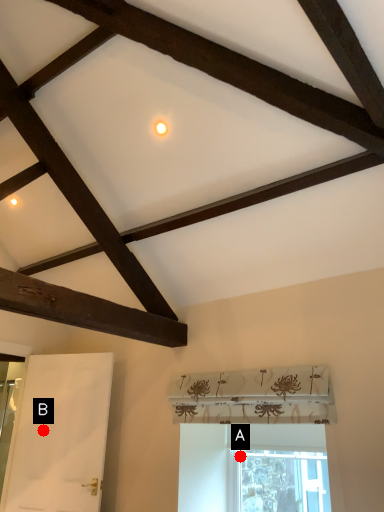
Question: Two points are circled on the image, labeled by A and B beside each circle. Which point is farther from the camera taking this photo?

Choices:
 (A) A is further
 (B) B is further

Answer: (B)